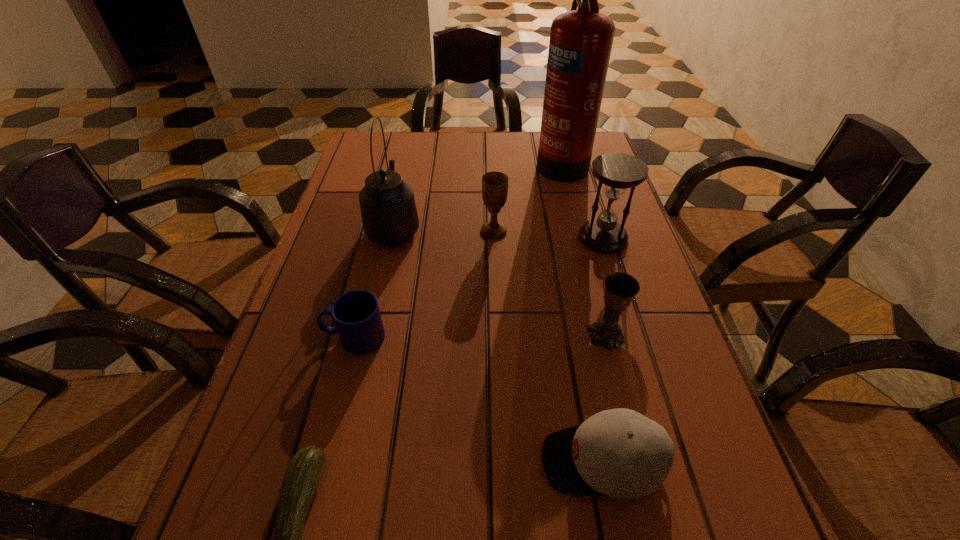
Identify the location of the farthest object. This screenshot has height=540, width=960. (581, 40).

This screenshot has width=960, height=540. I want to click on fire extinguisher, so click(x=581, y=40).

This screenshot has width=960, height=540. What are the coordinates of `the second tallest object` in the screenshot? It's located at (389, 215).

At what (x,y) coordinates should I click in order to perform the action: click on hourglass. Please return your answer as a coordinate pair (x, y). The image size is (960, 540). Looking at the image, I should click on (617, 171).

Find the location of a particular element. the farther chalice is located at coordinates (494, 184).

This screenshot has width=960, height=540. In order to click on the fourth object from left to right in this screenshot , I will do (x=494, y=184).

You are a GUI agent. You are given a task and a screenshot of the screen. Output one action in this format:
    pyautogui.click(x=<x>, y=<y>)
    Task: Click on the nearer chalice
    
    Given the screenshot: What is the action you would take?
    point(620,288)

This screenshot has width=960, height=540. I want to click on baseball cap, so click(x=620, y=453).

Image resolution: width=960 pixels, height=540 pixels. In order to click on mug in this screenshot , I will do `click(356, 314)`.

Locate an element on the screen. This screenshot has height=540, width=960. vacant space located 0.360m on the surface of the tallest object is located at coordinates (417, 161).